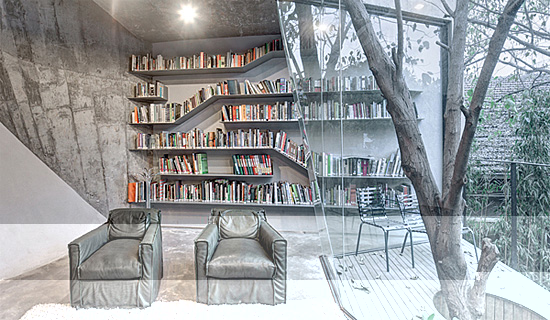
Find the location of a particular element. chair is located at coordinates (381, 226).